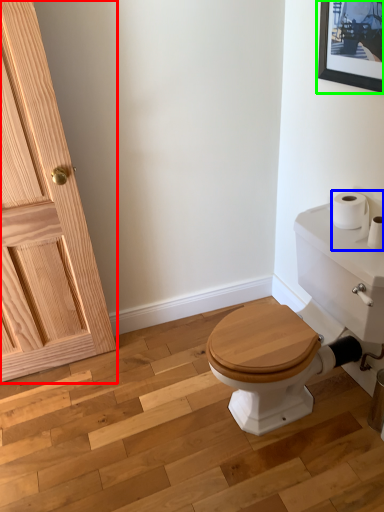
Question: Considering the real-world distances, which object is farthest from door (highlighted by a red box)? toilet paper (highlighted by a blue box) or picture frame (highlighted by a green box)?

Choices:
 (A) toilet paper
 (B) picture frame

Answer: (A)